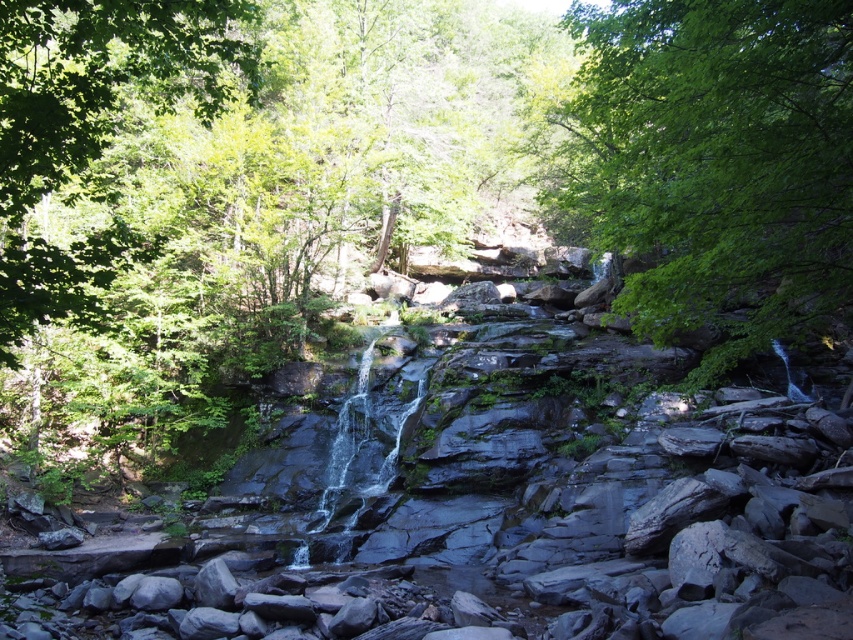
You are standing at the edge of the stream and want to see the green leafy tree at upper left. However, the green leafy tree at center is blocking your view. Can you move to a position where you can see both trees without any obstruction?

The green leafy tree at upper left is behind the green leafy tree at center, so you can move to a position where you are behind the green leafy tree at center to see both trees without obstruction.